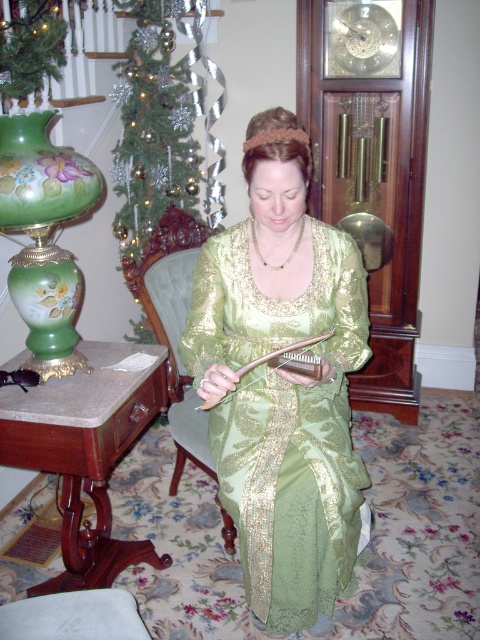
You are a fashion designer observing the vintage scene. You need to place a new accessory between the green satin dress at center and the gold chain necklace at center. Given the distance between them is 16.21 inches, what is the minimum length of the accessory to ensure it can fit snugly between them without overlapping either?

The green satin dress at center and gold chain necklace at center are 16.21 inches apart. To place the accessory between them without overlapping, the minimum length should be just over 16.21 inches, ensuring it spans the space between the two items.